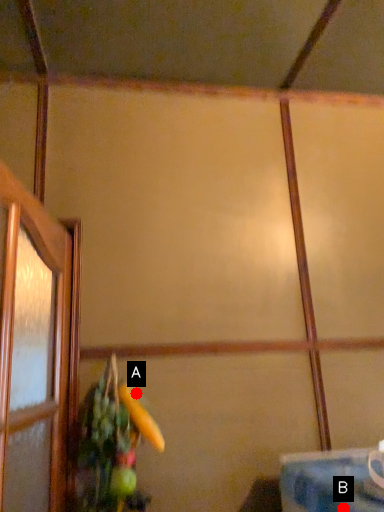
Question: Two points are circled on the image, labeled by A and B beside each circle. Among these points, which one is farthest from the camera?

Choices:
 (A) A is further
 (B) B is further

Answer: (A)